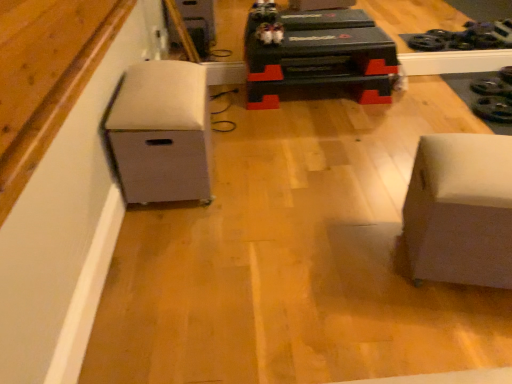
Question: Does white fabric storage bin at left, which is the second furniture from right to left, come in front of white matte wood at lower left?

Choices:
 (A) no
 (B) yes

Answer: (A)

Question: Is white fabric storage bin at left, the 1th furniture from the left, smaller than white matte wood at lower left?

Choices:
 (A) no
 (B) yes

Answer: (A)

Question: Can you confirm if white fabric storage bin at left, the 1th furniture from the left, is shorter than white matte wood at lower left?

Choices:
 (A) no
 (B) yes

Answer: (A)

Question: From a real-world perspective, is white fabric storage bin at left, the 1th furniture from the left, under white matte wood at lower left?

Choices:
 (A) yes
 (B) no

Answer: (A)

Question: Is white matte wood at lower left a part of white fabric storage bin at left, which is the second furniture from right to left?

Choices:
 (A) no
 (B) yes

Answer: (A)

Question: Is white fabric storage bin at left, which is the second furniture from right to left, to the left of white matte wood at lower left from the viewer's perspective?

Choices:
 (A) no
 (B) yes

Answer: (A)

Question: Is white matte ottoman at right, acting as the 1th furniture starting from the right, bigger than white matte wood at lower left?

Choices:
 (A) yes
 (B) no

Answer: (A)

Question: Is white matte ottoman at right, acting as the 1th furniture starting from the right, at the right side of white matte wood at lower left?

Choices:
 (A) yes
 (B) no

Answer: (A)

Question: Is white matte ottoman at right, acting as the 1th furniture starting from the right, facing towards white matte wood at lower left?

Choices:
 (A) no
 (B) yes

Answer: (A)

Question: Is white matte ottoman at right, acting as the 1th furniture starting from the right, outside white matte wood at lower left?

Choices:
 (A) no
 (B) yes

Answer: (B)

Question: Is white matte ottoman at right, acting as the 1th furniture starting from the right, directly adjacent to white matte wood at lower left?

Choices:
 (A) yes
 (B) no

Answer: (B)

Question: Is white matte ottoman at right, the 2th furniture from the left, turned away from white matte wood at lower left?

Choices:
 (A) no
 (B) yes

Answer: (A)

Question: Is white fabric storage bin at left, the 1th furniture from the left, bigger than white matte ottoman at right, acting as the 1th furniture starting from the right?

Choices:
 (A) no
 (B) yes

Answer: (B)